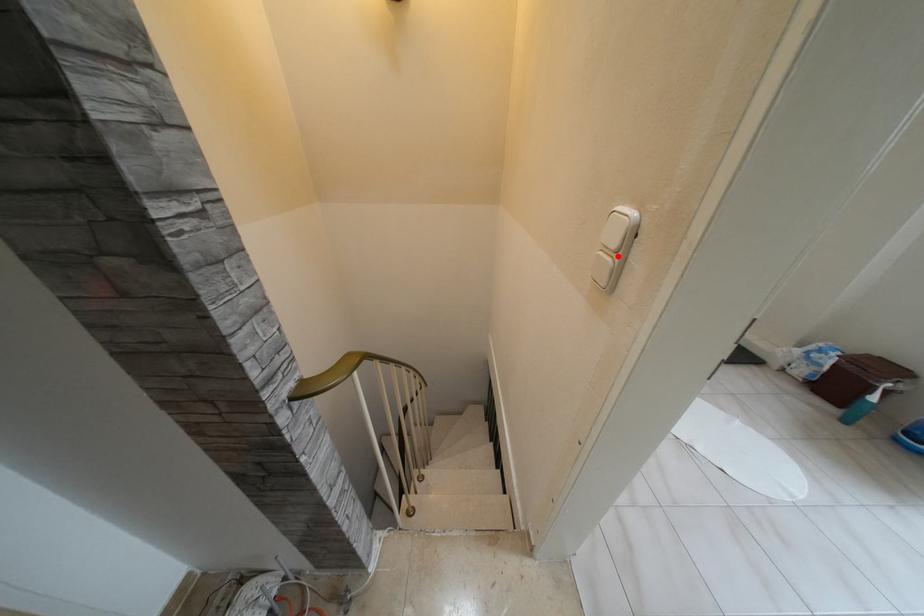
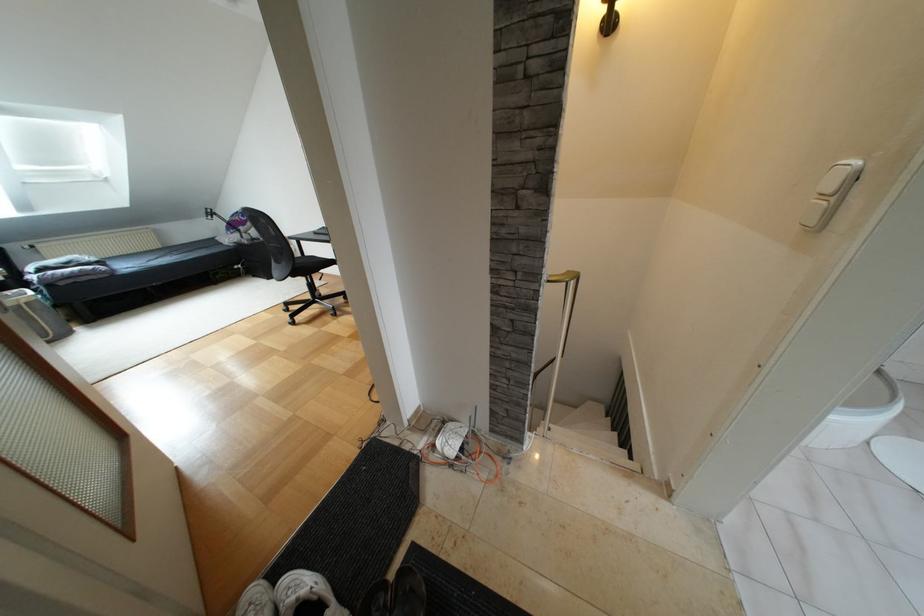
Where in the second image is the point corresponding to the highlighted location from the first image?

(833, 198)